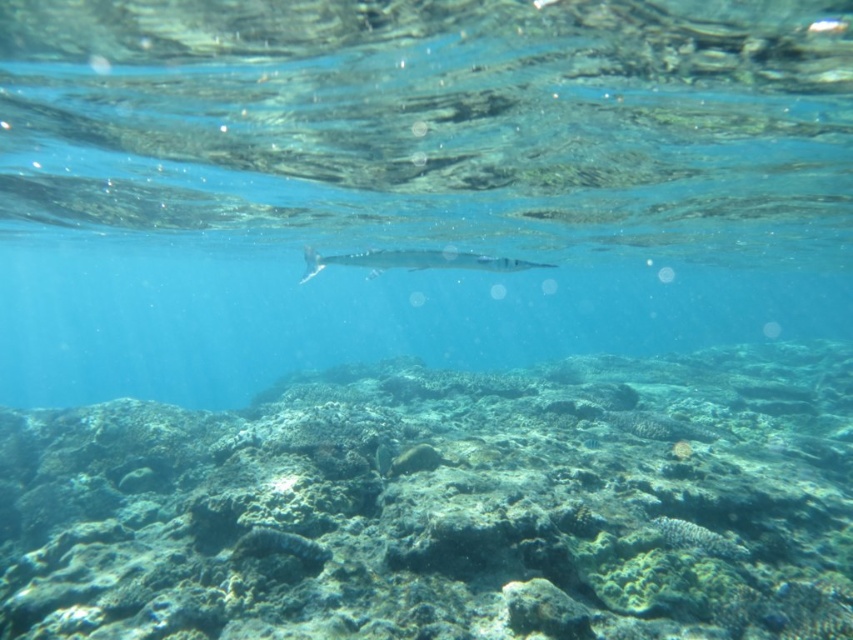
Who is positioned more to the right, clear blue water at center or silver metallic needlefish at center?

silver metallic needlefish at center is more to the right.

Is clear blue water at center smaller than silver metallic needlefish at center?

Incorrect, clear blue water at center is not smaller in size than silver metallic needlefish at center.

Is point (10, 19) positioned before point (552, 266)?

Yes, it is in front of point (552, 266).

I want to click on clear blue water at center, so click(410, 182).

Does clear blue water at center have a greater height compared to rough textured coral reef at center?

Indeed, clear blue water at center has a greater height compared to rough textured coral reef at center.

Who is shorter, clear blue water at center or rough textured coral reef at center?

Standing shorter between the two is rough textured coral reef at center.

In order to click on clear blue water at center in this screenshot , I will do `click(410, 182)`.

Where is `clear blue water at center`? Image resolution: width=853 pixels, height=640 pixels. clear blue water at center is located at coordinates (410, 182).

Who is shorter, rough textured coral reef at center or silver metallic needlefish at center?

rough textured coral reef at center

The image size is (853, 640). What do you see at coordinates (445, 506) in the screenshot?
I see `rough textured coral reef at center` at bounding box center [445, 506].

At what (x,y) coordinates should I click in order to perform the action: click on rough textured coral reef at center. Please return your answer as a coordinate pair (x, y). Looking at the image, I should click on click(445, 506).

In order to click on rough textured coral reef at center in this screenshot , I will do `click(445, 506)`.